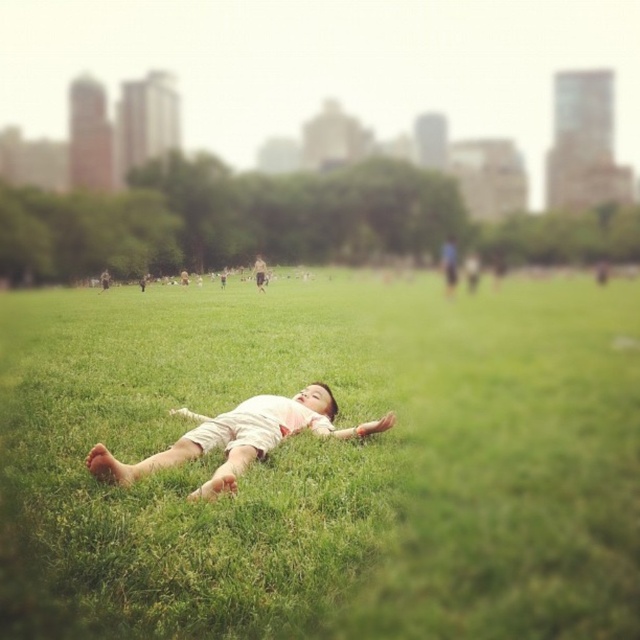
Consider the image. You are a photographer trying to capture the scene with the light pink cotton shirt at center and the light brown leather jacket at center. Which one is positioned lower in the image?

The light pink cotton shirt at center is below the light brown leather jacket at center, so it is positioned lower in the image.

You are standing in the park and want to place a 3.5 meter long picnic blanket on the green grass at center. Will the blanket reach the edge of the grass area?

The green grass at center is 4.03 meters away from the viewer. Since the picnic blanket is only 3.5 meters long, it will not reach the edge of the grass area.